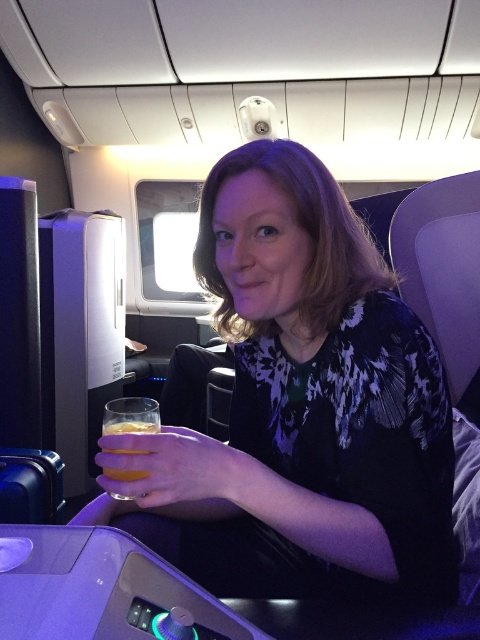
Question: Which of the following is the farthest from the observer?

Choices:
 (A) (131, 477)
 (B) (242, 296)

Answer: (B)

Question: Which of the following is the farthest from the observer?

Choices:
 (A) (233, 520)
 (B) (142, 417)

Answer: (A)

Question: Is the position of matte black dress at center less distant than that of translucent glass at lower left?

Choices:
 (A) no
 (B) yes

Answer: (B)

Question: Does matte black dress at center have a smaller size compared to translucent glass at lower left?

Choices:
 (A) yes
 (B) no

Answer: (B)

Question: Can you confirm if matte black dress at center is smaller than translucent glass at lower left?

Choices:
 (A) yes
 (B) no

Answer: (B)

Question: Among these points, which one is farthest from the camera?

Choices:
 (A) (124, 449)
 (B) (335, 326)

Answer: (B)